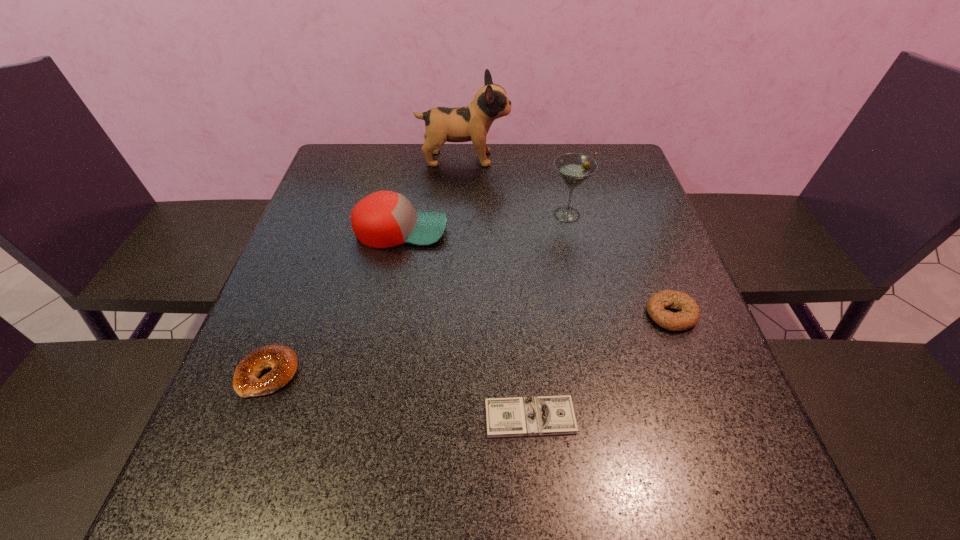
Where is `vacant space that satisfies the following two spatial constraints: 1. at the face of the farthest object; 2. on the front side of the left bagel`? The width and height of the screenshot is (960, 540). vacant space that satisfies the following two spatial constraints: 1. at the face of the farthest object; 2. on the front side of the left bagel is located at coordinates (453, 374).

Locate an element on the screen. free spot that satisfies the following two spatial constraints: 1. at the face of the rightmost object; 2. on the right side of the tallest object is located at coordinates (456, 314).

Find the location of `vacant area that satisfies the following two spatial constraints: 1. at the face of the puppy; 2. on the right side of the dollar`. vacant area that satisfies the following two spatial constraints: 1. at the face of the puppy; 2. on the right side of the dollar is located at coordinates (451, 417).

This screenshot has width=960, height=540. In order to click on free region that satisfies the following two spatial constraints: 1. at the brim of the fourth shortest object; 2. on the back side of the shortest object in this screenshot , I will do `click(365, 417)`.